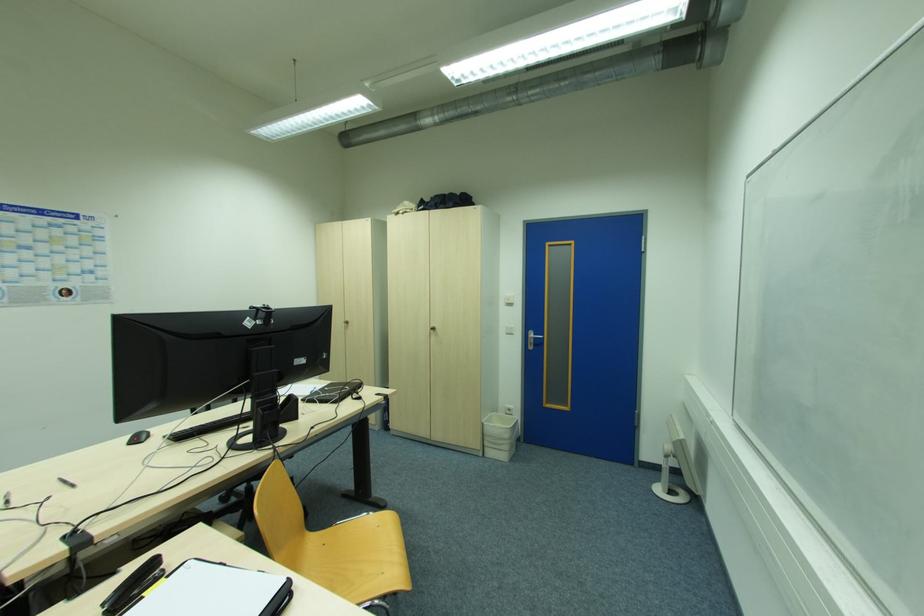
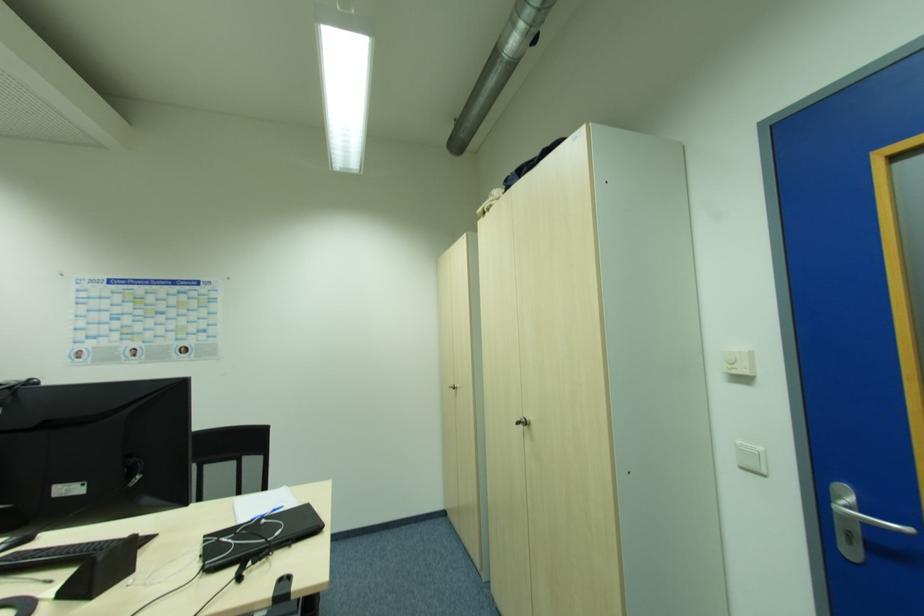
The point at (508, 334) is marked in the first image. Where is the corresponding point in the second image?

(746, 469)